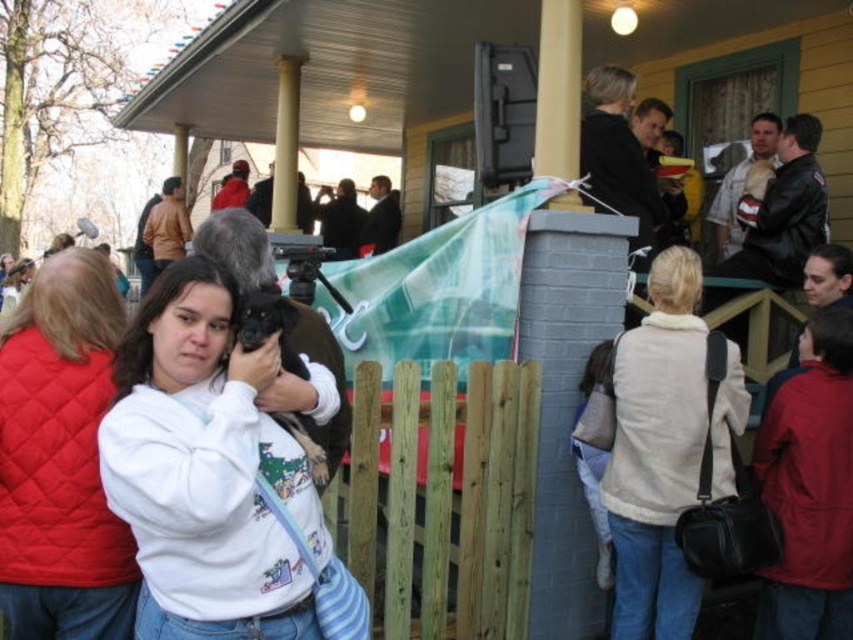
Question: Among these objects, which one is nearest to the camera?

Choices:
 (A) white fleece sweatshirt at center
 (B) beige fleece vest at upper right

Answer: (A)

Question: Does beige fleece vest at upper right appear under white painted wood column at upper center?

Choices:
 (A) no
 (B) yes

Answer: (B)

Question: Does white fleece sweatshirt at center appear over brown wooden fence at center?

Choices:
 (A) no
 (B) yes

Answer: (B)

Question: Is white fleece sweatshirt at center below brown wooden fence at center?

Choices:
 (A) no
 (B) yes

Answer: (A)

Question: Which is nearer to the brown wooden fence at center?

Choices:
 (A) beige fleece vest at upper right
 (B) white quilted vest at center
 (C) white painted wood column at upper center

Answer: (A)

Question: Considering the real-world distances, which object is farthest from the white quilted vest at center?

Choices:
 (A) white fleece sweatshirt at center
 (B) white painted wood column at upper center

Answer: (B)